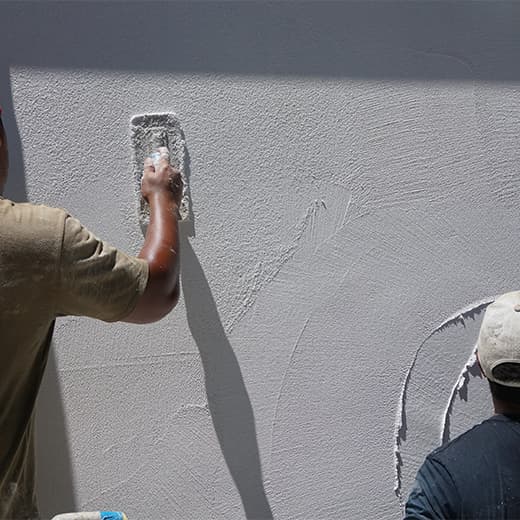
What are the coordinates of `painted wall with no shadows` in the screenshot? It's located at (350, 224), (138, 403).